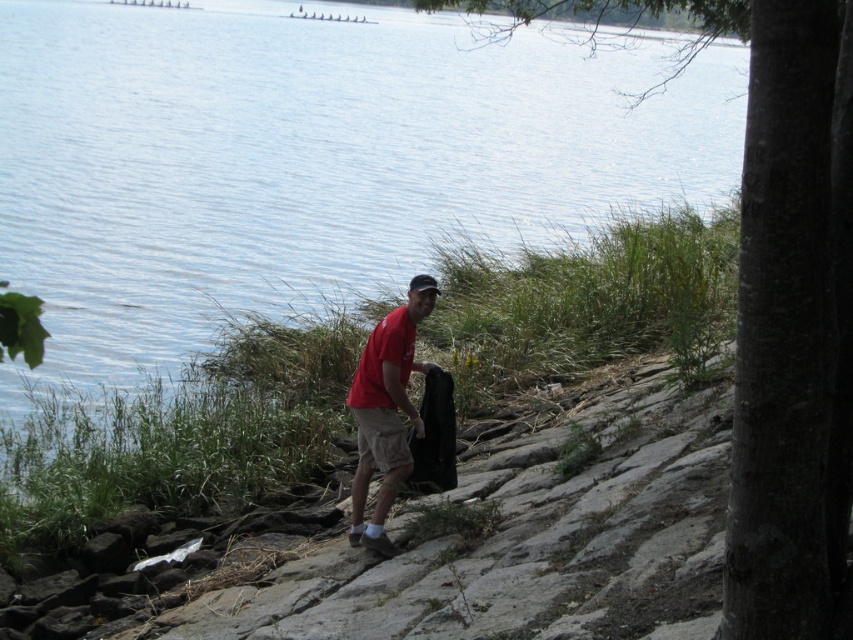
Can you confirm if blue water at center is taller than matte red t-shirt at center?

Indeed, blue water at center has a greater height compared to matte red t-shirt at center.

Between point (167, 332) and point (363, 529), which one is positioned in front?

Point (363, 529)

Identify the location of blue water at center. (306, 161).